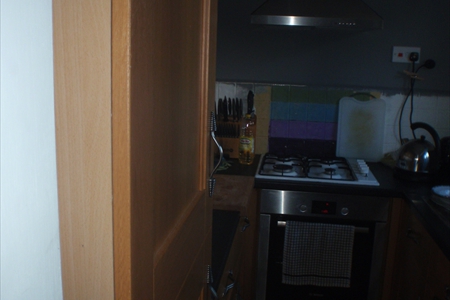
The height and width of the screenshot is (300, 450). In order to click on plug in wall socket in this screenshot , I will do `click(414, 56)`.